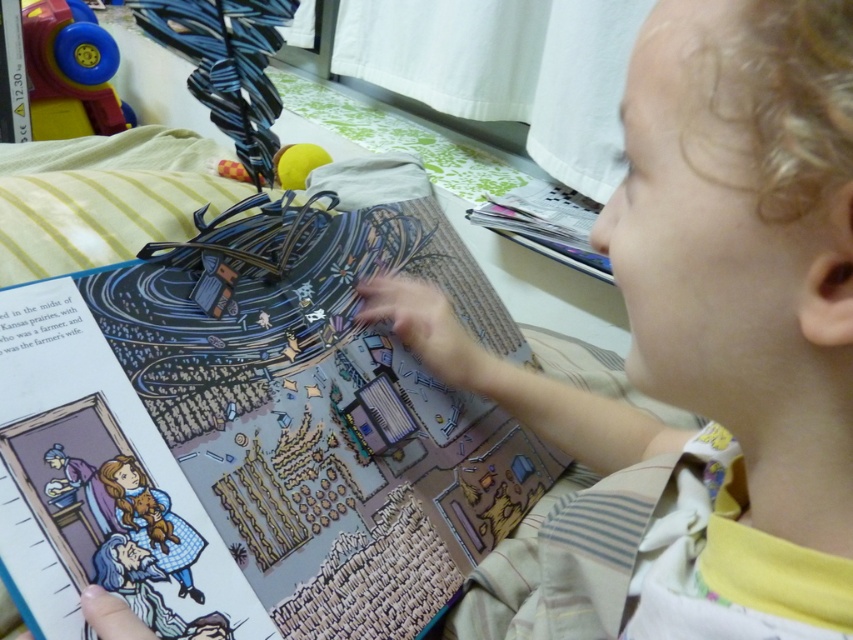
Question: Can you confirm if smooth beige shirt at center is smaller than colorful paper comic book at center?

Choices:
 (A) no
 (B) yes

Answer: (B)

Question: Which object is closer to the camera taking this photo?

Choices:
 (A) smooth beige shirt at center
 (B) rubberized plastic toy at upper left

Answer: (A)

Question: Does colorful paper comic book at center appear under rubberized plastic toy at upper left?

Choices:
 (A) no
 (B) yes

Answer: (B)

Question: Which object is farther from the camera taking this photo?

Choices:
 (A) colorful paper comic book at center
 (B) rubberized plastic toy at upper left
 (C) smooth beige shirt at center

Answer: (B)

Question: Which point is farther from the camera taking this photo?

Choices:
 (A) (633, 529)
 (B) (166, 268)

Answer: (B)

Question: Can you confirm if smooth beige shirt at center is positioned to the left of colorful paper comic book at center?

Choices:
 (A) no
 (B) yes

Answer: (A)